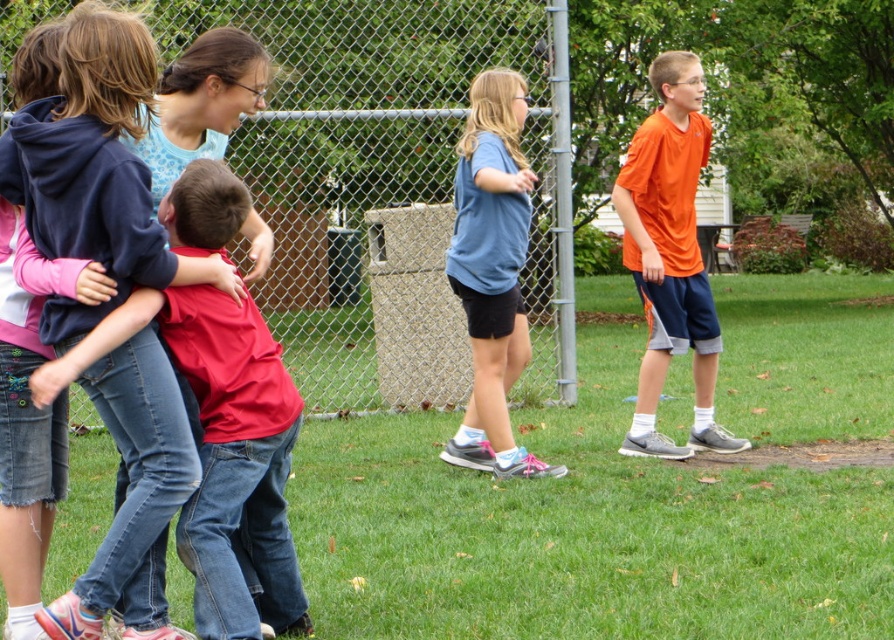
Measure the distance between metallic chain-link fence at upper center and orange matte shirt at right.

metallic chain-link fence at upper center is 5.38 meters from orange matte shirt at right.

Is metallic chain-link fence at upper center to the right of orange matte shirt at right from the viewer's perspective?

Incorrect, metallic chain-link fence at upper center is not on the right side of orange matte shirt at right.

Locate an element on the screen. This screenshot has width=894, height=640. metallic chain-link fence at upper center is located at coordinates (392, 188).

Identify the location of metallic chain-link fence at upper center. point(392,188).

Find the location of a particular element. matte red shirt at left is located at coordinates (93, 154).

Is matte red shirt at left bigger than matte red shirt at center-left?

Yes.

You are a GUI agent. You are given a task and a screenshot of the screen. Output one action in this format:
    pyautogui.click(x=<x>, y=<y>)
    Task: Click on the matte red shirt at left
    The width and height of the screenshot is (894, 640).
    Given the screenshot: What is the action you would take?
    pyautogui.click(x=93, y=154)

Is orange matte shirt at right to the right of blue cotton shirt at center from the viewer's perspective?

Yes, orange matte shirt at right is to the right of blue cotton shirt at center.

Can you confirm if orange matte shirt at right is smaller than blue cotton shirt at center?

Actually, orange matte shirt at right might be larger than blue cotton shirt at center.

Which is in front, point (679, 113) or point (533, 456)?

Point (679, 113)

Where is `orange matte shirt at right`? The height and width of the screenshot is (640, 894). orange matte shirt at right is located at coordinates (670, 257).